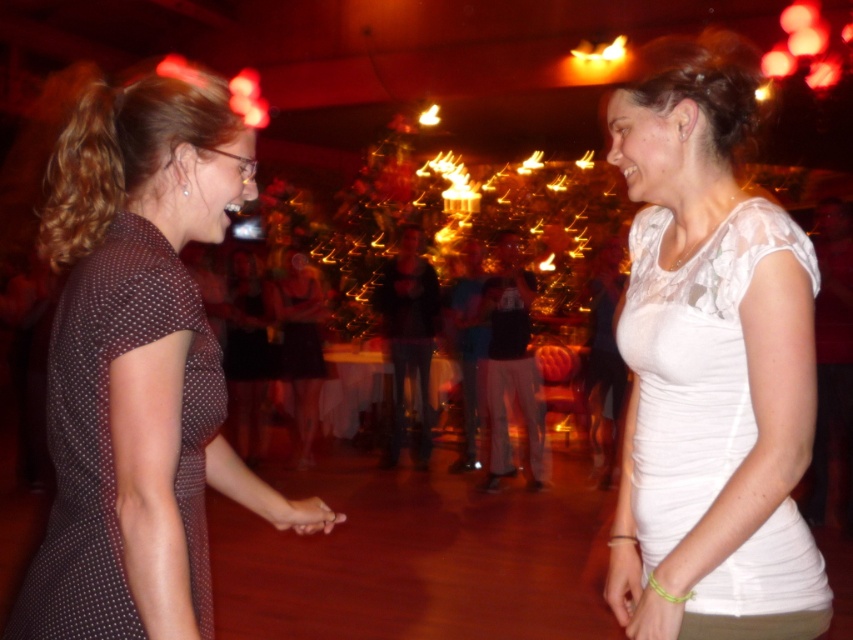
Based on the photo, you are a photographer at the event and want to capture a photo of both the white sheer blouse at center and the dark brown sheer dress at left. Based on their positions, which one is higher in the frame?

The white sheer blouse at center is higher in the frame than the dark brown sheer dress at left.

Consider the image. You are standing at the edge of the dance floor and notice two women in the foreground. One is wearing a dark dress with a dotted pattern, and the other is in a white top. There is a specific point marked at coordinates (300, 344). Which object from the two women or their clothing items is located at this point?

The dark brown dress at center is located at point (300, 344).

You are a photographer at the party and need to capture a photo of the dark brown dress at center and the white matte wristband at lower right. If you want to ensure both are in frame, should you zoom in or out from the current angle?

You should zoom out because the dark brown dress at center is wider than the white matte wristband at lower right, so zooming out will ensure both fit in the frame.